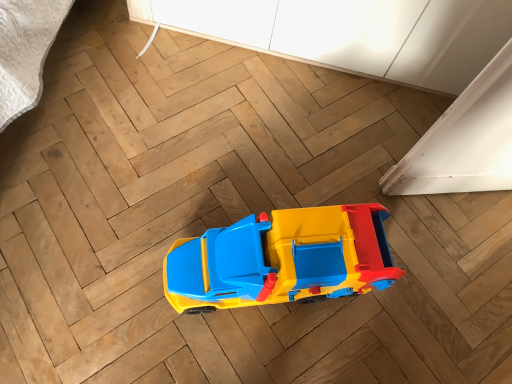
The height and width of the screenshot is (384, 512). Find the location of `unoccupied area behind matte plastic toy car at center`. unoccupied area behind matte plastic toy car at center is located at coordinates (288, 156).